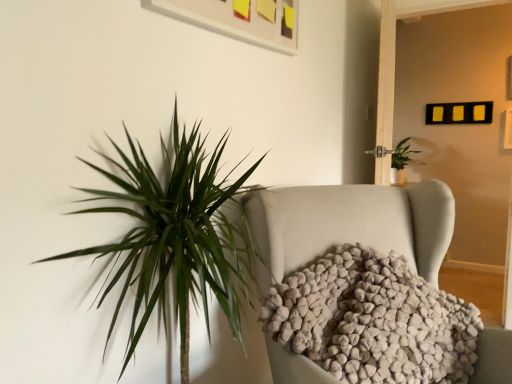
Question: Can you confirm if white fuzzy blanket at center is smaller than green leafy plant at upper right?

Choices:
 (A) yes
 (B) no

Answer: (B)

Question: Does white fuzzy blanket at center have a larger size compared to green leafy plant at upper right?

Choices:
 (A) no
 (B) yes

Answer: (B)

Question: Are white fuzzy blanket at center and green leafy plant at upper right located far from each other?

Choices:
 (A) yes
 (B) no

Answer: (A)

Question: From the image's perspective, is white fuzzy blanket at center beneath green leafy plant at upper right?

Choices:
 (A) no
 (B) yes

Answer: (B)

Question: Could you tell me if white fuzzy blanket at center is facing green leafy plant at upper right?

Choices:
 (A) yes
 (B) no

Answer: (B)

Question: Can you confirm if white fuzzy blanket at center is positioned to the left of green leafy plant at upper right?

Choices:
 (A) yes
 (B) no

Answer: (A)

Question: Is green leafy plant at upper right not inside white fuzzy blanket at center?

Choices:
 (A) yes
 (B) no

Answer: (A)

Question: Does green leafy plant at upper right have a greater width compared to white fuzzy blanket at center?

Choices:
 (A) no
 (B) yes

Answer: (B)

Question: Does green leafy plant at upper right appear on the left side of white fuzzy blanket at center?

Choices:
 (A) no
 (B) yes

Answer: (A)

Question: From a real-world perspective, does green leafy plant at upper right sit lower than white fuzzy blanket at center?

Choices:
 (A) yes
 (B) no

Answer: (B)

Question: Is green leafy plant at upper right smaller than white fuzzy blanket at center?

Choices:
 (A) no
 (B) yes

Answer: (B)

Question: Considering the relative sizes of green leafy plant at upper right and white fuzzy blanket at center in the image provided, is green leafy plant at upper right thinner than white fuzzy blanket at center?

Choices:
 (A) no
 (B) yes

Answer: (A)

Question: Is green leafy plant at upper right in front of or behind white fuzzy blanket at center in the image?

Choices:
 (A) front
 (B) behind

Answer: (B)